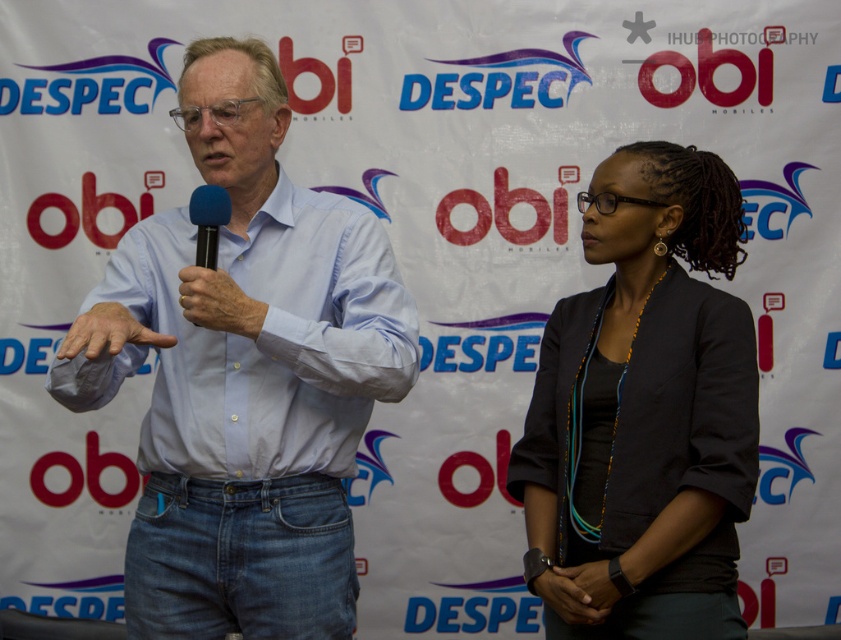
Who is more distant from viewer, (x=665, y=561) or (x=221, y=220)?

Point (x=665, y=561)

Is point (574, 564) farther from camera compared to point (198, 209)?

Yes, point (574, 564) is farther from viewer.

You are a GUI agent. You are given a task and a screenshot of the screen. Output one action in this format:
    pyautogui.click(x=<x>, y=<y>)
    Task: Click on the dark gray blazer at center
    This screenshot has width=841, height=640.
    Given the screenshot: What is the action you would take?
    pyautogui.click(x=644, y=412)

Does light blue shirt at center have a larger size compared to black matte microphone at center?

Correct, light blue shirt at center is larger in size than black matte microphone at center.

The width and height of the screenshot is (841, 640). Identify the location of light blue shirt at center. (244, 374).

Describe the element at coordinates (244, 374) in the screenshot. I see `light blue shirt at center` at that location.

Does light blue shirt at center appear on the right side of dark gray blazer at center?

No, light blue shirt at center is not to the right of dark gray blazer at center.

Where is `light blue shirt at center`? light blue shirt at center is located at coordinates (244, 374).